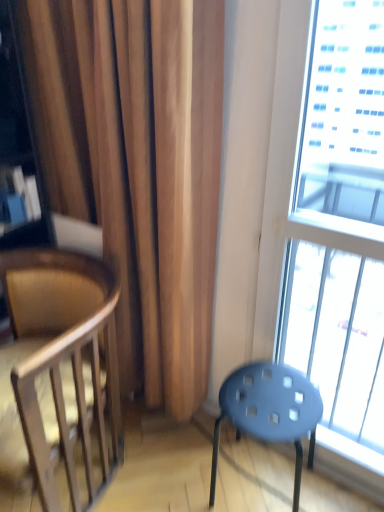
Identify the location of blank space above matte blue stool at lower right (from a real-world perspective). (263, 392).